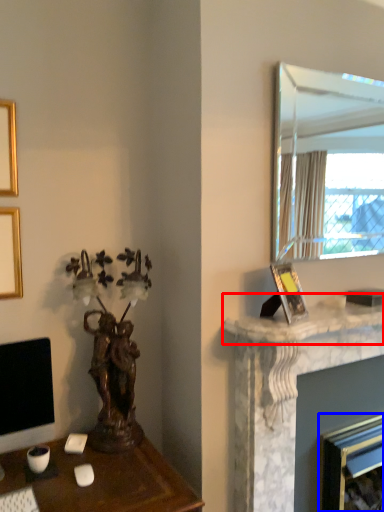
Question: Which point is further to the camera, counter top (highlighted by a red box) or fireplace (highlighted by a blue box)?

Choices:
 (A) counter top
 (B) fireplace

Answer: (B)